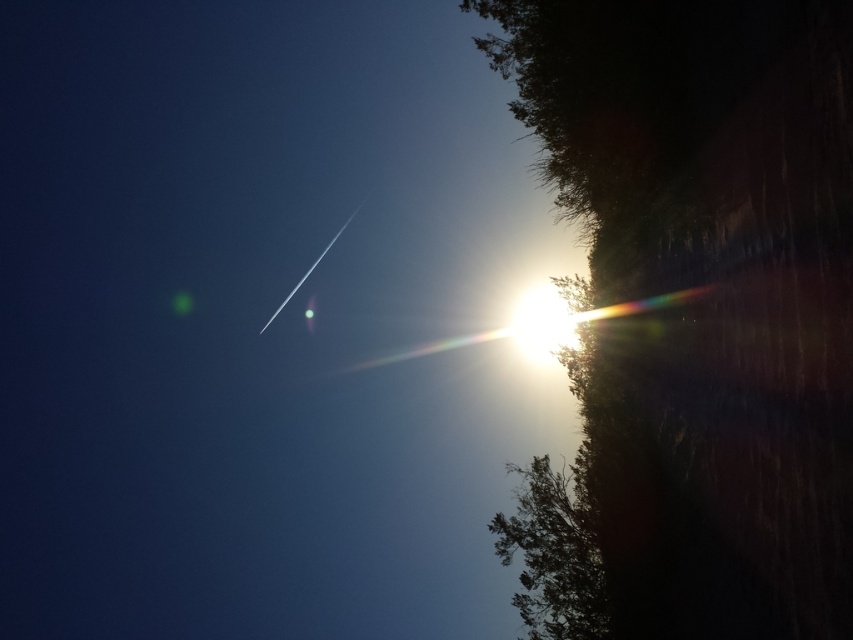
Can you confirm if silhouette leafy tree at right is positioned above green leafy tree at lower right?

Indeed, silhouette leafy tree at right is positioned over green leafy tree at lower right.

Can you confirm if silhouette leafy tree at right is thinner than green leafy tree at lower right?

No, silhouette leafy tree at right is not thinner than green leafy tree at lower right.

The width and height of the screenshot is (853, 640). Identify the location of silhouette leafy tree at right. (695, 314).